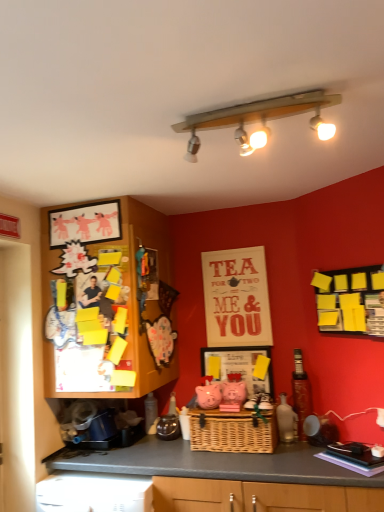
This screenshot has width=384, height=512. What are the coordinates of `vacant region above wooden with frosted glass lights at upper center (from a real-world perspective)` in the screenshot? It's located at (268, 96).